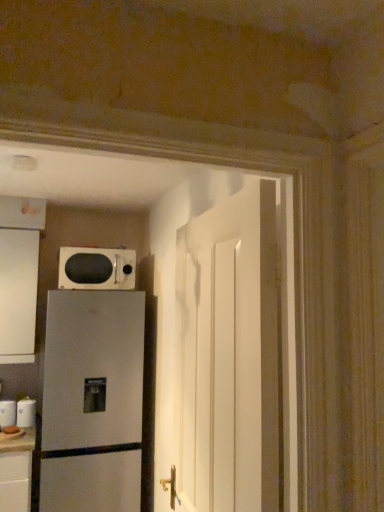
In order to face white matte cabinet at left, should I rotate leftwards or rightwards?

You should look left and rotate roughly 22.189 degrees.

At what (x,y) coordinates should I click in order to perform the action: click on white glossy door at center. Please return your answer as a coordinate pair (x, y). The height and width of the screenshot is (512, 384). Looking at the image, I should click on (228, 356).

Describe the element at coordinates (228, 356) in the screenshot. I see `white glossy door at center` at that location.

Where is `white glossy mug at lower left, which is the 1th appliance from left to right`? The width and height of the screenshot is (384, 512). white glossy mug at lower left, which is the 1th appliance from left to right is located at coordinates (7, 413).

Image resolution: width=384 pixels, height=512 pixels. What do you see at coordinates (96, 268) in the screenshot? I see `white glossy microwave at upper center` at bounding box center [96, 268].

This screenshot has height=512, width=384. I want to click on white matte cabinet at left, so click(x=19, y=276).

Which is in front, point (48, 329) or point (108, 285)?

The point (48, 329) is more forward.

Between satin silver refrigerator at lower left and white glossy microwave at upper center, which one has more height?

satin silver refrigerator at lower left is taller.

From the picture: Can you confirm if satin silver refrigerator at lower left is positioned to the right of white glossy microwave at upper center?

Incorrect, satin silver refrigerator at lower left is not on the right side of white glossy microwave at upper center.

Is the position of satin silver refrigerator at lower left less distant than that of white matte cabinet at left?

Yes.

Considering the sizes of objects satin silver refrigerator at lower left and white matte cabinet at left in the image provided, who is wider, satin silver refrigerator at lower left or white matte cabinet at left?

Wider between the two is satin silver refrigerator at lower left.

Considering the relative sizes of satin silver refrigerator at lower left and white matte cabinet at left in the image provided, is satin silver refrigerator at lower left taller than white matte cabinet at left?

Yes, satin silver refrigerator at lower left is taller than white matte cabinet at left.

Who is taller, white glossy paper towel dispenser at lower left, which appears as the second appliance when viewed from the left, or white glossy door at center?

Standing taller between the two is white glossy door at center.

In order to click on the 1st appliance to the left when counting from the white glossy door at center in this screenshot , I will do `click(26, 413)`.

Is white glossy paper towel dispenser at lower left, which is the first appliance in right-to-left order, bigger or smaller than white glossy mug at lower left, which is the 1th appliance from left to right?

white glossy paper towel dispenser at lower left, which is the first appliance in right-to-left order, is smaller than white glossy mug at lower left, which is the 1th appliance from left to right.

Consider the image. From the image's perspective, between white glossy paper towel dispenser at lower left, which appears as the second appliance when viewed from the left, and white glossy mug at lower left, which is the 1th appliance from left to right, who is located below?

white glossy mug at lower left, which is the 1th appliance from left to right.

Is there a large distance between white glossy paper towel dispenser at lower left, which is the first appliance in right-to-left order, and white glossy mug at lower left, which is the 1th appliance from left to right?

No, white glossy paper towel dispenser at lower left, which is the first appliance in right-to-left order, is not far away from white glossy mug at lower left, which is the 1th appliance from left to right.

Where is `appliance above the white glossy mug at lower left, which is the 1th appliance from left to right (from the image's perspective)`? The width and height of the screenshot is (384, 512). appliance above the white glossy mug at lower left, which is the 1th appliance from left to right (from the image's perspective) is located at coordinates pyautogui.click(x=26, y=413).

Between white glossy microwave at upper center and white matte cabinet at left, which one has larger size?

With larger size is white matte cabinet at left.

Which is closer to the camera, (62, 284) or (37, 202)?

The point (37, 202) is in front.

Considering the positions of objects white glossy microwave at upper center and white matte cabinet at left in the image provided, who is more to the left, white glossy microwave at upper center or white matte cabinet at left?

From the viewer's perspective, white matte cabinet at left appears more on the left side.

In terms of width, does white glossy microwave at upper center look wider or thinner when compared to white matte cabinet at left?

Considering their sizes, white glossy microwave at upper center looks slimmer than white matte cabinet at left.

Between white glossy paper towel dispenser at lower left, which appears as the second appliance when viewed from the left, and white matte cabinet at left, which one has larger size?

Bigger between the two is white matte cabinet at left.

From the image's perspective, is white glossy paper towel dispenser at lower left, which is the first appliance in right-to-left order, above white matte cabinet at left?

Actually, white glossy paper towel dispenser at lower left, which is the first appliance in right-to-left order, appears below white matte cabinet at left in the image.

Find the location of a particular element. cabinetry in front of the white glossy paper towel dispenser at lower left, which is the first appliance in right-to-left order is located at coordinates (19, 276).

How much distance is there between white glossy paper towel dispenser at lower left, which appears as the second appliance when viewed from the left, and white matte cabinet at left?

The distance of white glossy paper towel dispenser at lower left, which appears as the second appliance when viewed from the left, from white matte cabinet at left is 27.77 inches.

Between white glossy mug at lower left, which is the 1th appliance from left to right, and white matte cabinet at left, which one has smaller size?

white glossy mug at lower left, which is the 1th appliance from left to right.

Is white glossy mug at lower left, which is counted as the second appliance, starting from the right, situated inside white matte cabinet at left or outside?

white glossy mug at lower left, which is counted as the second appliance, starting from the right, is located beyond the bounds of white matte cabinet at left.

This screenshot has width=384, height=512. I want to click on appliance lying on the left of white matte cabinet at left, so (7, 413).

This screenshot has width=384, height=512. I want to click on refrigerator below the white glossy microwave at upper center (from the image's perspective), so click(x=92, y=401).

This screenshot has height=512, width=384. In order to click on refrigerator below the white matte cabinet at left (from a real-world perspective) in this screenshot , I will do `click(92, 401)`.

Which object lies nearer to the anchor point white glossy mug at lower left, which is the 1th appliance from left to right, white glossy paper towel dispenser at lower left, which appears as the second appliance when viewed from the left, or satin silver refrigerator at lower left?

white glossy paper towel dispenser at lower left, which appears as the second appliance when viewed from the left, lies closer to white glossy mug at lower left, which is the 1th appliance from left to right, than the other object.

Which object lies nearer to the anchor point white glossy paper towel dispenser at lower left, which is the first appliance in right-to-left order, white glossy door at center or satin silver refrigerator at lower left?

Among the two, satin silver refrigerator at lower left is located nearer to white glossy paper towel dispenser at lower left, which is the first appliance in right-to-left order.

Which object lies nearer to the anchor point satin silver refrigerator at lower left, white glossy door at center or white glossy microwave at upper center?

white glossy microwave at upper center lies closer to satin silver refrigerator at lower left than the other object.

When comparing their distances from satin silver refrigerator at lower left, does white glossy microwave at upper center or white glossy mug at lower left, which is counted as the second appliance, starting from the right, seem further?

white glossy mug at lower left, which is counted as the second appliance, starting from the right.

Based on their spatial positions, is satin silver refrigerator at lower left or white glossy microwave at upper center closer to white glossy mug at lower left, which is the 1th appliance from left to right?

satin silver refrigerator at lower left lies closer to white glossy mug at lower left, which is the 1th appliance from left to right, than the other object.

Based on their spatial positions, is white glossy microwave at upper center or white matte cabinet at left further from white glossy mug at lower left, which is the 1th appliance from left to right?

The object further to white glossy mug at lower left, which is the 1th appliance from left to right, is white glossy microwave at upper center.

Considering their positions, is white glossy mug at lower left, which is counted as the second appliance, starting from the right, positioned further to white matte cabinet at left than white glossy door at center?

white glossy door at center lies further to white matte cabinet at left than the other object.

Which object lies further to the anchor point satin silver refrigerator at lower left, white glossy door at center or white matte cabinet at left?

Among the two, white glossy door at center is located further to satin silver refrigerator at lower left.

This screenshot has height=512, width=384. Find the location of `refrigerator located between white glossy door at center and white glossy paper towel dispenser at lower left, which appears as the second appliance when viewed from the left, in the depth direction`. refrigerator located between white glossy door at center and white glossy paper towel dispenser at lower left, which appears as the second appliance when viewed from the left, in the depth direction is located at coordinates (92, 401).

Where is `refrigerator between white glossy door at center and white glossy mug at lower left, which is the 1th appliance from left to right, in the front-back direction`? This screenshot has height=512, width=384. refrigerator between white glossy door at center and white glossy mug at lower left, which is the 1th appliance from left to right, in the front-back direction is located at coordinates (92, 401).

This screenshot has height=512, width=384. I want to click on appliance between white glossy microwave at upper center and white glossy mug at lower left, which is the 1th appliance from left to right, vertically, so click(x=26, y=413).

At what (x,y) coordinates should I click in order to perform the action: click on microwave oven located between white glossy door at center and white glossy mug at lower left, which is the 1th appliance from left to right, in the depth direction. Please return your answer as a coordinate pair (x, y). The width and height of the screenshot is (384, 512). Looking at the image, I should click on (96, 268).